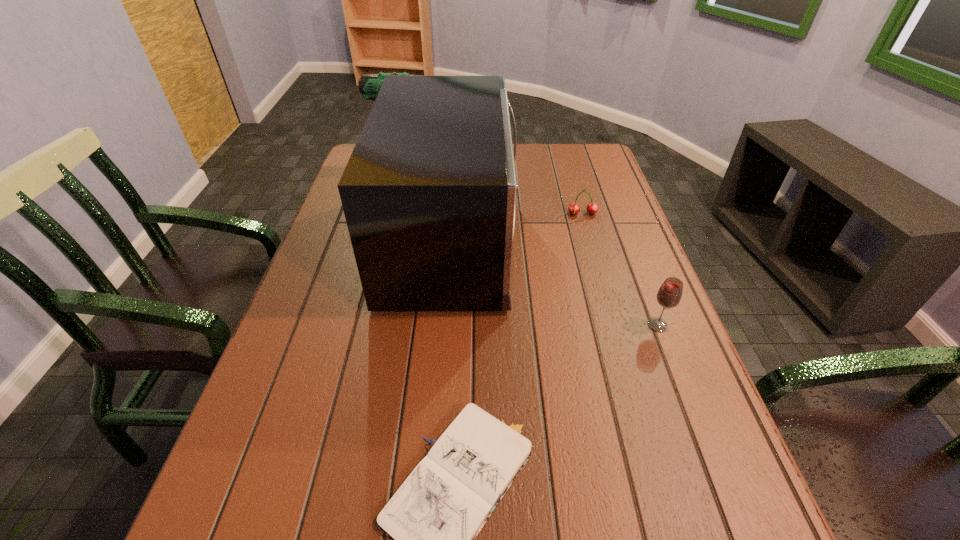
I want to click on unoccupied position between the glass drink container and the microwave oven, so click(555, 282).

In order to click on vacant space in between the microwave oven and the fourth object from left to right in this screenshot , I will do `click(517, 227)`.

Select which object appears as the third closest to the cherry. Please provide its 2D coordinates. Your answer should be formatted as a tuple, i.e. [(x, y)], where the tuple contains the x and y coordinates of a point satisfying the conditions above.

[(369, 85)]

This screenshot has height=540, width=960. Identify the location of object that is the fourth closest to the rightmost object. (369, 85).

Find the location of a particular element. free region that satisfies the following two spatial constraints: 1. on the handle side of the third shortest object; 2. on the left side of the farthest object is located at coordinates (382, 325).

Locate an element on the screen. This screenshot has height=540, width=960. vacant region that satisfies the following two spatial constraints: 1. with stems pointing upwards on the fourth tallest object; 2. on the right side of the fourth farthest object is located at coordinates (615, 325).

Locate an element on the screen. This screenshot has height=540, width=960. free space that satisfies the following two spatial constraints: 1. on the handle side of the drill; 2. on the back side of the fourth farthest object is located at coordinates (382, 325).

Find the location of a particular element. The width and height of the screenshot is (960, 540). free spot that satisfies the following two spatial constraints: 1. on the back side of the rightmost object; 2. on the handle side of the farthest object is located at coordinates (592, 155).

This screenshot has height=540, width=960. In order to click on vacant region that satisfies the following two spatial constraints: 1. with the door open on the tallest object; 2. on the left side of the second nearest object in this screenshot , I will do `click(445, 325)`.

In order to click on free location that satisfies the following two spatial constraints: 1. on the handle side of the drill; 2. on the right side of the rightmost object in this screenshot , I will do `click(382, 325)`.